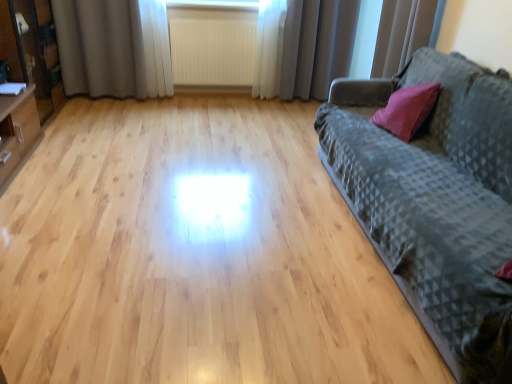
Identify the location of matte black cabinet at left. The height and width of the screenshot is (384, 512). (27, 77).

Where is `white sheer curtain at upper right, which is counted as the third curtain, starting from the left`? This screenshot has height=384, width=512. white sheer curtain at upper right, which is counted as the third curtain, starting from the left is located at coordinates [x=401, y=34].

The width and height of the screenshot is (512, 384). Describe the element at coordinates (212, 45) in the screenshot. I see `white textured radiator at center` at that location.

I want to click on gray fabric curtain at upper center, the 2th curtain positioned from the left, so click(304, 47).

This screenshot has height=384, width=512. I want to click on gray fabric curtain at upper left, which is counted as the 3th curtain, starting from the right, so click(x=114, y=47).

Where is `dark gray textured fabric couch at right`? dark gray textured fabric couch at right is located at coordinates (436, 201).

Is white sheer curtain at upper right, which is counted as the third curtain, starting from the left, located outside gray fabric curtain at upper center, which ranks as the second curtain in right-to-left order?

white sheer curtain at upper right, which is counted as the third curtain, starting from the left, is positioned outside gray fabric curtain at upper center, which ranks as the second curtain in right-to-left order.

Is white sheer curtain at upper right, which is counted as the third curtain, starting from the left, closer to the viewer compared to gray fabric curtain at upper center, the 2th curtain positioned from the left?

Yes, it is in front of gray fabric curtain at upper center, the 2th curtain positioned from the left.

I want to click on curtain that is the 1st one below the white sheer curtain at upper right, which ranks as the 1th curtain in right-to-left order (from a real-world perspective), so click(x=304, y=47).

From the picture: Is gray fabric curtain at upper center, which ranks as the second curtain in right-to-left order, in front of or behind white sheer curtain at upper right, which ranks as the 1th curtain in right-to-left order, in the image?

In the image, gray fabric curtain at upper center, which ranks as the second curtain in right-to-left order, appears behind white sheer curtain at upper right, which ranks as the 1th curtain in right-to-left order.

Choose the correct answer: Is gray fabric curtain at upper center, which ranks as the second curtain in right-to-left order, inside white sheer curtain at upper right, which ranks as the 1th curtain in right-to-left order, or outside it?

gray fabric curtain at upper center, which ranks as the second curtain in right-to-left order, is outside white sheer curtain at upper right, which ranks as the 1th curtain in right-to-left order.

From the image's perspective, between gray fabric curtain at upper center, the 2th curtain positioned from the left, and white sheer curtain at upper right, which ranks as the 1th curtain in right-to-left order, which one is located above?

gray fabric curtain at upper center, the 2th curtain positioned from the left, is shown above in the image.

Which is closer, (411,261) or (20,66)?

Clearly, point (411,261) is closer to the camera than point (20,66).

From the image's perspective, who appears lower, dark gray textured fabric couch at right or matte black cabinet at left?

dark gray textured fabric couch at right, from the image's perspective.

From a real-world perspective, is dark gray textured fabric couch at right positioned above or below matte black cabinet at left?

From a real-world perspective, dark gray textured fabric couch at right is physically below matte black cabinet at left.

Is white sheer curtain at upper right, which ranks as the 1th curtain in right-to-left order, inside gray fabric curtain at upper left, which is counted as the first curtain, starting from the left?

No, white sheer curtain at upper right, which ranks as the 1th curtain in right-to-left order, is located outside of gray fabric curtain at upper left, which is counted as the first curtain, starting from the left.

Is gray fabric curtain at upper left, which is counted as the first curtain, starting from the left, looking in the opposite direction of white sheer curtain at upper right, which ranks as the 1th curtain in right-to-left order?

No, gray fabric curtain at upper left, which is counted as the first curtain, starting from the left,'s orientation is not away from white sheer curtain at upper right, which ranks as the 1th curtain in right-to-left order.

Is gray fabric curtain at upper left, which is counted as the 3th curtain, starting from the right, wider or thinner than white sheer curtain at upper right, which ranks as the 1th curtain in right-to-left order?

In the image, gray fabric curtain at upper left, which is counted as the 3th curtain, starting from the right, appears to be more narrow than white sheer curtain at upper right, which ranks as the 1th curtain in right-to-left order.

Does gray fabric curtain at upper left, which is counted as the first curtain, starting from the left, have a lesser height compared to white sheer curtain at upper right, which is counted as the third curtain, starting from the left?

No.

Between white sheer curtain at upper right, which ranks as the 1th curtain in right-to-left order, and white textured radiator at center, which one has larger size?

white sheer curtain at upper right, which ranks as the 1th curtain in right-to-left order.

From the image's perspective, is white sheer curtain at upper right, which ranks as the 1th curtain in right-to-left order, beneath white textured radiator at center?

Yes, from the image's perspective, white sheer curtain at upper right, which ranks as the 1th curtain in right-to-left order, is beneath white textured radiator at center.

Where is `radiator behind the white sheer curtain at upper right, which is counted as the third curtain, starting from the left`? The image size is (512, 384). radiator behind the white sheer curtain at upper right, which is counted as the third curtain, starting from the left is located at coordinates (212, 45).

Which is in front, point (405, 27) or point (193, 57)?

Positioned in front is point (405, 27).

Does gray fabric curtain at upper left, which is counted as the first curtain, starting from the left, appear on the left side of matte black cabinet at left?

Incorrect, gray fabric curtain at upper left, which is counted as the first curtain, starting from the left, is not on the left side of matte black cabinet at left.

From a real-world perspective, which object rests below the other?

gray fabric curtain at upper left, which is counted as the 3th curtain, starting from the right, is physically lower.

Is gray fabric curtain at upper left, which is counted as the first curtain, starting from the left, not inside matte black cabinet at left?

Yes, gray fabric curtain at upper left, which is counted as the first curtain, starting from the left, is located beyond the bounds of matte black cabinet at left.

From a real-world perspective, who is located lower, white textured radiator at center or white sheer curtain at upper right, which is counted as the third curtain, starting from the left?

From a 3D spatial view, white textured radiator at center is below.

Locate an element on the screen. the 2nd curtain counting from the right side of the white textured radiator at center is located at coordinates (401, 34).

Is white textured radiator at center surrounding white sheer curtain at upper right, which is counted as the third curtain, starting from the left?

That's incorrect, white sheer curtain at upper right, which is counted as the third curtain, starting from the left, is not inside white textured radiator at center.

Is there a large distance between white textured radiator at center and white sheer curtain at upper right, which is counted as the third curtain, starting from the left?

Indeed, white textured radiator at center is not near white sheer curtain at upper right, which is counted as the third curtain, starting from the left.

Starting from the white sheer curtain at upper right, which ranks as the 1th curtain in right-to-left order, which curtain is the 1st one to the left? Please provide its 2D coordinates.

[(304, 47)]

At what (x,y) coordinates should I click in order to perform the action: click on the 2nd curtain behind the white sheer curtain at upper right, which is counted as the third curtain, starting from the left, starting your count from the anchor. Please return your answer as a coordinate pair (x, y). Looking at the image, I should click on (304, 47).

From the image, which object appears to be farther from white sheer curtain at upper right, which is counted as the third curtain, starting from the left, dark gray textured fabric couch at right or matte black cabinet at left?

matte black cabinet at left.

Looking at the image, which one is located further to matte black cabinet at left, gray fabric curtain at upper center, which ranks as the second curtain in right-to-left order, or gray fabric curtain at upper left, which is counted as the first curtain, starting from the left?

gray fabric curtain at upper center, which ranks as the second curtain in right-to-left order.

Looking at the image, which one is located further to white sheer curtain at upper right, which is counted as the third curtain, starting from the left, gray fabric curtain at upper center, the 2th curtain positioned from the left, or dark gray textured fabric couch at right?

dark gray textured fabric couch at right is further to white sheer curtain at upper right, which is counted as the third curtain, starting from the left.

Considering their positions, is matte black cabinet at left positioned closer to white sheer curtain at upper right, which is counted as the third curtain, starting from the left, than gray fabric curtain at upper left, which is counted as the first curtain, starting from the left?

The object closer to white sheer curtain at upper right, which is counted as the third curtain, starting from the left, is gray fabric curtain at upper left, which is counted as the first curtain, starting from the left.

Considering their positions, is white textured radiator at center positioned further to matte black cabinet at left than gray fabric curtain at upper center, which ranks as the second curtain in right-to-left order?

gray fabric curtain at upper center, which ranks as the second curtain in right-to-left order, is positioned further to the anchor matte black cabinet at left.

Looking at the image, which one is located further to white textured radiator at center, gray fabric curtain at upper left, which is counted as the 3th curtain, starting from the right, or dark gray textured fabric couch at right?

Among the two, dark gray textured fabric couch at right is located further to white textured radiator at center.

Looking at the image, which one is located closer to gray fabric curtain at upper center, which ranks as the second curtain in right-to-left order, gray fabric curtain at upper left, which is counted as the first curtain, starting from the left, or dark gray textured fabric couch at right?

gray fabric curtain at upper left, which is counted as the first curtain, starting from the left, is positioned closer to the anchor gray fabric curtain at upper center, which ranks as the second curtain in right-to-left order.

From the image, which object appears to be nearer to gray fabric curtain at upper center, the 2th curtain positioned from the left, white sheer curtain at upper right, which is counted as the third curtain, starting from the left, or white textured radiator at center?

white textured radiator at center lies closer to gray fabric curtain at upper center, the 2th curtain positioned from the left, than the other object.

You are a GUI agent. You are given a task and a screenshot of the screen. Output one action in this format:
    pyautogui.click(x=<x>, y=<y>)
    Task: Click on the curtain between white textured radiator at center and white sheer curtain at upper right, which is counted as the third curtain, starting from the left, from left to right
    This screenshot has width=512, height=384.
    Given the screenshot: What is the action you would take?
    pyautogui.click(x=304, y=47)

Identify the location of radiator between matte black cabinet at left and gray fabric curtain at upper center, which ranks as the second curtain in right-to-left order, from left to right. (212, 45).

The height and width of the screenshot is (384, 512). I want to click on studio couch located between matte black cabinet at left and white sheer curtain at upper right, which is counted as the third curtain, starting from the left, in the left-right direction, so click(x=436, y=201).

At what (x,y) coordinates should I click in order to perform the action: click on radiator located between gray fabric curtain at upper left, which is counted as the 3th curtain, starting from the right, and gray fabric curtain at upper center, the 2th curtain positioned from the left, in the left-right direction. Please return your answer as a coordinate pair (x, y). Looking at the image, I should click on (212, 45).